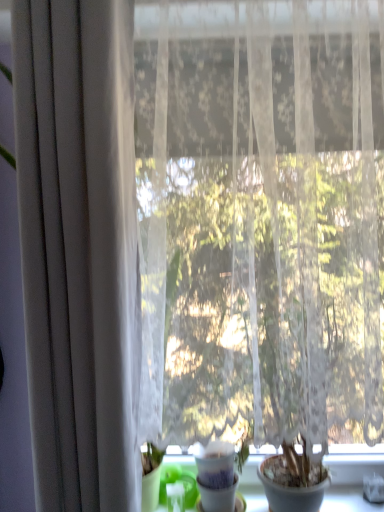
Question: Is matte gray curtain at left completely or partially outside of white matte pot at center?

Choices:
 (A) yes
 (B) no

Answer: (A)

Question: Is matte gray curtain at left in front of white matte pot at center?

Choices:
 (A) no
 (B) yes

Answer: (B)

Question: Would you say matte gray curtain at left contains white matte pot at center?

Choices:
 (A) no
 (B) yes

Answer: (A)

Question: Is matte gray curtain at left facing towards white matte pot at center?

Choices:
 (A) no
 (B) yes

Answer: (A)

Question: Considering the relative positions of matte gray curtain at left and white matte pot at center in the image provided, is matte gray curtain at left to the right of white matte pot at center from the viewer's perspective?

Choices:
 (A) yes
 (B) no

Answer: (B)

Question: Does matte gray curtain at left have a greater height compared to white matte pot at center?

Choices:
 (A) no
 (B) yes

Answer: (B)

Question: Is green plastic at lower left facing towards matte gray curtain at left?

Choices:
 (A) no
 (B) yes

Answer: (A)

Question: Is green plastic at lower left to the left of matte gray curtain at left from the viewer's perspective?

Choices:
 (A) yes
 (B) no

Answer: (B)

Question: Is green plastic at lower left positioned in front of matte gray curtain at left?

Choices:
 (A) yes
 (B) no

Answer: (B)

Question: Is green plastic at lower left thinner than matte gray curtain at left?

Choices:
 (A) yes
 (B) no

Answer: (B)

Question: Are green plastic at lower left and matte gray curtain at left making contact?

Choices:
 (A) no
 (B) yes

Answer: (A)

Question: Can you confirm if green plastic at lower left is wider than matte gray curtain at left?

Choices:
 (A) yes
 (B) no

Answer: (A)

Question: Is white matte pot at center with matte gray curtain at left?

Choices:
 (A) no
 (B) yes

Answer: (A)